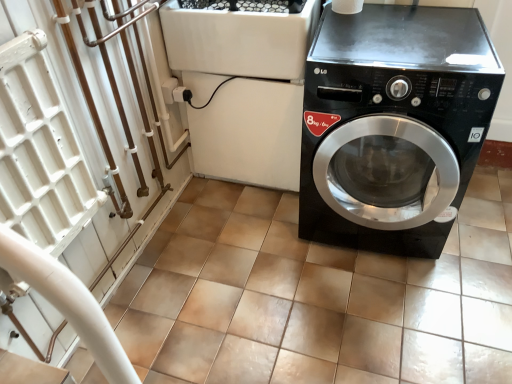
Question: Considering the relative positions of black glossy washing machine at right and black plastic washing machine at center in the image provided, is black glossy washing machine at right to the left of black plastic washing machine at center from the viewer's perspective?

Choices:
 (A) no
 (B) yes

Answer: (A)

Question: From a real-world perspective, is black glossy washing machine at right on black plastic washing machine at center?

Choices:
 (A) yes
 (B) no

Answer: (A)

Question: Is black glossy washing machine at right with black plastic washing machine at center?

Choices:
 (A) no
 (B) yes

Answer: (A)

Question: Could you tell me if black glossy washing machine at right is turned towards black plastic washing machine at center?

Choices:
 (A) yes
 (B) no

Answer: (B)

Question: Is black glossy washing machine at right not near black plastic washing machine at center?

Choices:
 (A) yes
 (B) no

Answer: (B)

Question: Based on their sizes in the image, would you say black glossy washing machine at right is bigger or smaller than brown tile at center?

Choices:
 (A) small
 (B) big

Answer: (B)

Question: From a real-world perspective, is black glossy washing machine at right physically located above or below brown tile at center?

Choices:
 (A) below
 (B) above

Answer: (B)

Question: From their relative heights in the image, would you say black glossy washing machine at right is taller or shorter than brown tile at center?

Choices:
 (A) tall
 (B) short

Answer: (A)

Question: Looking at their shapes, would you say black glossy washing machine at right is wider or thinner than brown tile at center?

Choices:
 (A) wide
 (B) thin

Answer: (B)

Question: In the image, is brown tile at center positioned in front of or behind black plastic washing machine at center?

Choices:
 (A) behind
 (B) front

Answer: (B)

Question: Considering the positions of brown tile at center and black plastic washing machine at center in the image, is brown tile at center bigger or smaller than black plastic washing machine at center?

Choices:
 (A) big
 (B) small

Answer: (B)

Question: Considering the positions of brown tile at center and black plastic washing machine at center in the image, is brown tile at center taller or shorter than black plastic washing machine at center?

Choices:
 (A) tall
 (B) short

Answer: (B)

Question: Would you say brown tile at center is to the left or to the right of black plastic washing machine at center in the picture?

Choices:
 (A) left
 (B) right

Answer: (B)

Question: Is black plastic washing machine at center situated inside black glossy washing machine at right or outside?

Choices:
 (A) inside
 (B) outside

Answer: (B)

Question: In the image, is black plastic washing machine at center positioned in front of or behind black glossy washing machine at right?

Choices:
 (A) behind
 (B) front

Answer: (A)